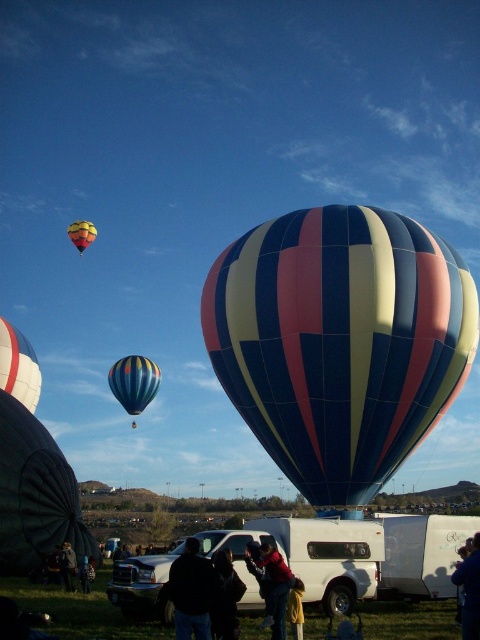
You are standing in the middle of the hot air balloon festival field and see the multicolored striped balloon at center and the multicolored striped hot air balloon at upper left. Which one is positioned more to the right side of the scene?

The multicolored striped balloon at center is positioned more to the right side of the scene compared to the multicolored striped hot air balloon at upper left.

You are a photographer standing in the field at the hot air balloon festival. You want to take a photo that includes both the multicolored striped balloon at center and the multicolored striped hot air balloon at upper left. Which balloon should you position closer to the front of your photo to ensure both are in focus?

You should position the multicolored striped balloon at center closer to the front of your photo because it is closer to the viewer than the multicolored striped hot air balloon at upper left. This way, both balloons will be in focus as they are at different distances.

You are a photographer standing in the field where the hot air balloons are anchored. You want to take a photo that includes both the white glossy balloon at left and the dark fabric jacket at center. Which object should you focus on first to ensure both are in sharp focus?

The white glossy balloon at left is further to the viewer than the dark fabric jacket at center. To ensure both are in sharp focus, you should focus on the dark fabric jacket at center first, as it is closer to the background, allowing the depth of field to cover both objects.